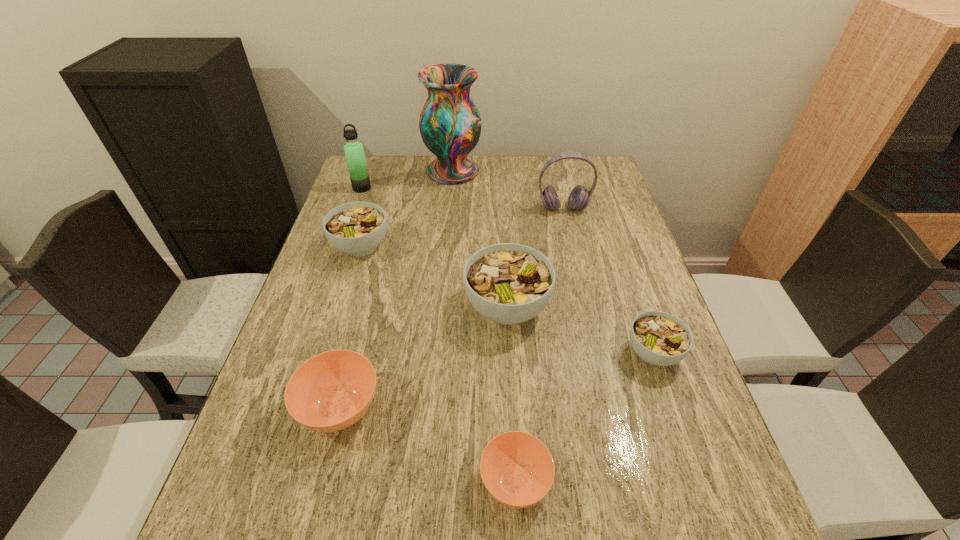
Identify which object is located as the sixth nearest to the second white soup bowl from right to left. Please provide its 2D coordinates. Your answer should be formatted as a tuple, i.e. [(x, y)], where the tuple contains the x and y coordinates of a point satisfying the conditions above.

[(450, 124)]

Locate an element on the screen. The height and width of the screenshot is (540, 960). the third closest object to the tallest object is located at coordinates (356, 228).

You are a GUI agent. You are given a task and a screenshot of the screen. Output one action in this format:
    pyautogui.click(x=<x>, y=<y>)
    Task: Click on the soup bowl that is the second closest to the second biggest white soup bowl
    
    Given the screenshot: What is the action you would take?
    (x=331, y=391)

Identify which soup bowl is located as the fourth nearest to the leftmost white soup bowl. Please provide its 2D coordinates. Your answer should be formatted as a tuple, i.e. [(x, y)], where the tuple contains the x and y coordinates of a point satisfying the conditions above.

[(659, 338)]

Locate which white soup bowl ranks third in proximity to the sixth shortest object. Please provide its 2D coordinates. Your answer should be formatted as a tuple, i.e. [(x, y)], where the tuple contains the x and y coordinates of a point satisfying the conditions above.

[(659, 338)]

Locate which white soup bowl ranks in proximity to the smallest white soup bowl. Please provide its 2D coordinates. Your answer should be formatted as a tuple, i.e. [(x, y)], where the tuple contains the x and y coordinates of a point satisfying the conditions above.

[(507, 283)]

Where is `free space that satisfies the following two spatial constraints: 1. on the back side of the tallest object; 2. on the left side of the left peach soup bowl`? The image size is (960, 540). free space that satisfies the following two spatial constraints: 1. on the back side of the tallest object; 2. on the left side of the left peach soup bowl is located at coordinates (399, 171).

The width and height of the screenshot is (960, 540). Identify the location of free space that satisfies the following two spatial constraints: 1. on the front side of the smaller peach soup bowl; 2. on the left side of the thermos bottle. (259, 481).